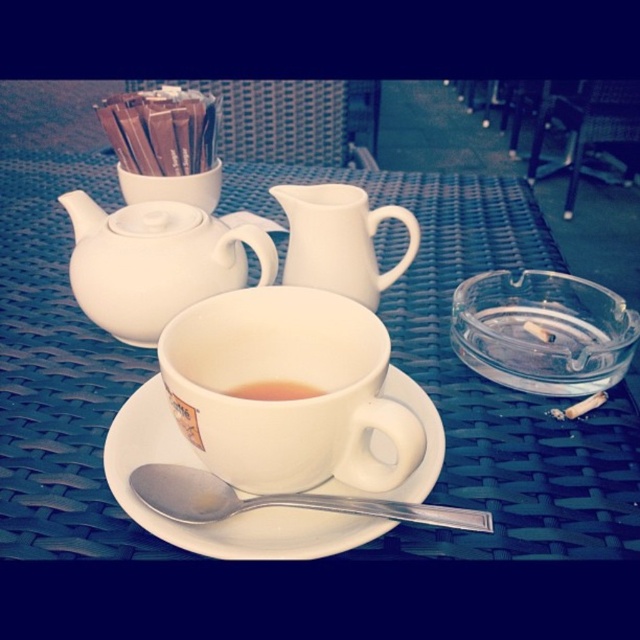
Question: Which object is positioned closest to the white ceramic cup at center?

Choices:
 (A) white ceramic saucer at center
 (B) white glossy pitcher at center

Answer: (A)

Question: Which point appears closest to the camera in this image?

Choices:
 (A) (433, 451)
 (B) (244, 397)
 (C) (358, 188)
 (D) (337, 429)

Answer: (D)

Question: Which point is closer to the camera?

Choices:
 (A) white ceramic saucer at center
 (B) white ceramic cup at center
 (C) white glossy pitcher at center

Answer: (B)

Question: Can you confirm if white glossy pitcher at center is positioned to the left of brown matte cup at center?

Choices:
 (A) yes
 (B) no

Answer: (B)

Question: Does silver metallic spoon at lower center have a larger size compared to brown matte cup at center?

Choices:
 (A) no
 (B) yes

Answer: (B)

Question: Does white ceramic cup at center have a smaller size compared to silver metallic spoon at lower center?

Choices:
 (A) no
 (B) yes

Answer: (A)